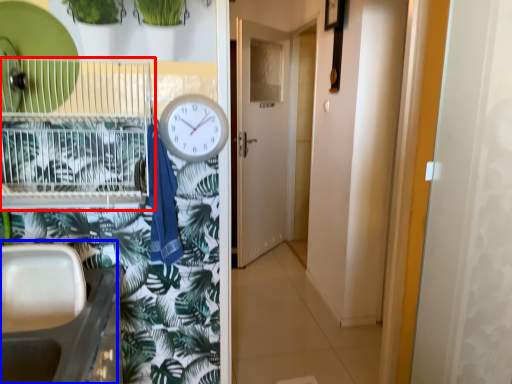
Question: Which object is closer to the camera taking this photo, bird cage (highlighted by a red box) or sink (highlighted by a blue box)?

Choices:
 (A) bird cage
 (B) sink

Answer: (B)